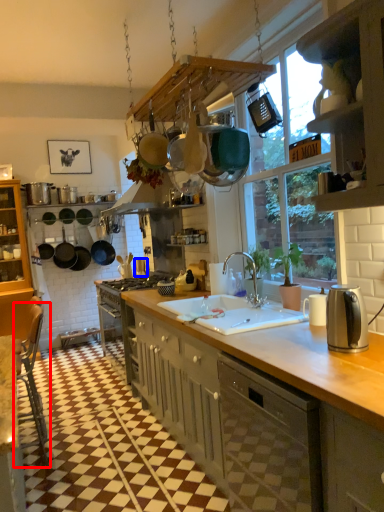
Question: Which point is closer to the camera, chair (highlighted by a red box) or appliance (highlighted by a blue box)?

Choices:
 (A) chair
 (B) appliance

Answer: (A)